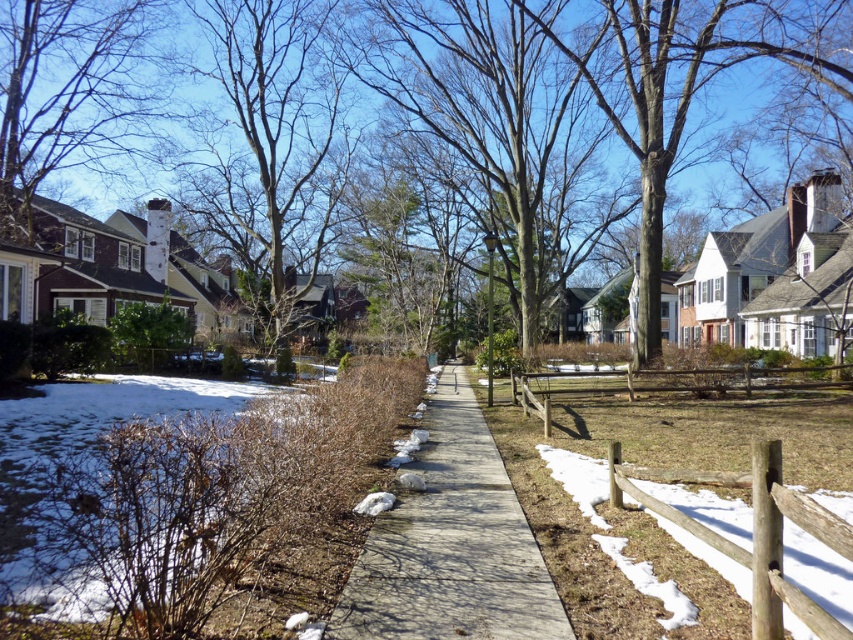
Is brown wooden fence at lower right to the left of brown wooden fence at center-right from the viewer's perspective?

Correct, you'll find brown wooden fence at lower right to the left of brown wooden fence at center-right.

Can you confirm if brown wooden fence at lower right is positioned to the right of brown wooden fence at center-right?

In fact, brown wooden fence at lower right is to the left of brown wooden fence at center-right.

Between point (708, 504) and point (575, 376), which one is positioned in front?

Positioned in front is point (708, 504).

Where is `brown wooden fence at lower right`? brown wooden fence at lower right is located at coordinates (819, 570).

Is point (276, 260) in front of point (740, 515)?

No, (276, 260) is behind (740, 515).

Between brown textured tree at upper left and brown wooden fence at lower right, which one is positioned lower?

brown wooden fence at lower right is below.

Is point (326, 96) positioned after point (572, 493)?

Yes.

This screenshot has width=853, height=640. I want to click on brown textured tree at upper left, so (270, 147).

Consider the image. Is concrete at center positioned before brown wooden fence at lower right?

Yes, it is.

The width and height of the screenshot is (853, 640). What do you see at coordinates (451, 545) in the screenshot? I see `concrete at center` at bounding box center [451, 545].

This screenshot has height=640, width=853. In order to click on concrete at center in this screenshot , I will do `click(451, 545)`.